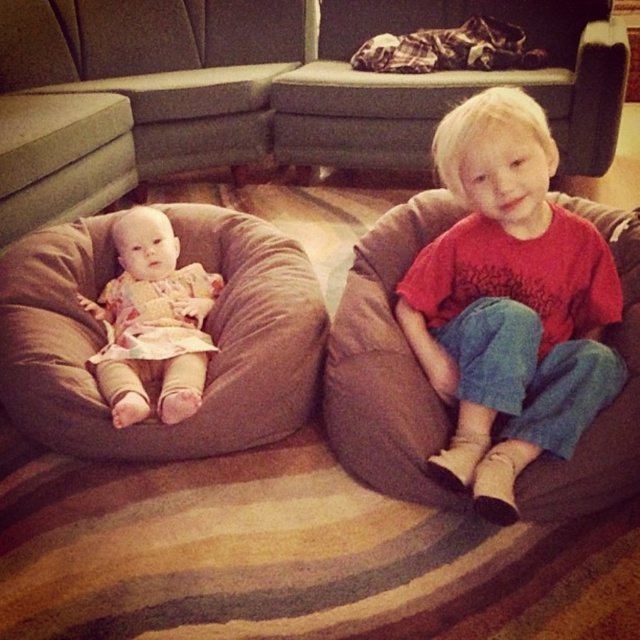
You are a parent trying to organize your childen room. You see the brown soft bean bag chair at left and the floral fabric baby doll at left. Which object is positioned higher in the image?

The brown soft bean bag chair at left is located above the floral fabric baby doll at left, so it is positioned higher in the image.

You are a photographer setting up a shot in this room. You need to place a small prop exactly halfway between point (186, 4) and point (108, 301). Will the prop be closer to the viewer or farther away compared to both points?

The prop placed halfway between point (186, 4) and point (108, 301) will be closer to the viewer than point (108, 301) but farther than point (186, 4) since it is halfway between them.

You are a photographer setting up for a family photo. You need to position a small stool between the matte red shirt at center and the floral fabric baby doll at left so that both children can sit at the same height. Given that the stool can be adjusted in height, which child requires the stool to be raised more to reach their original height?

The matte red shirt at center is much taller than the floral fabric baby doll at left, so the stool needs to be raised more for the floral fabric baby doll at left to match the original height of the matte red shirt at center.